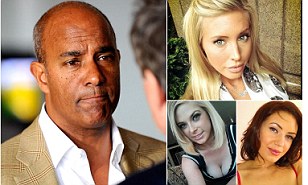
Find the location of a particular element. The width and height of the screenshot is (308, 185). couch is located at coordinates (178, 174).